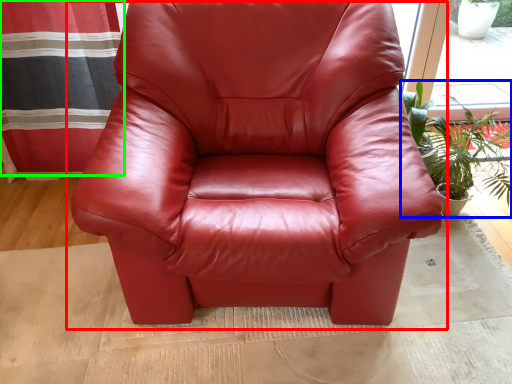
Question: Which object is positioned farthest from chair (highlighted by a red box)? Select from houseplant (highlighted by a blue box) and curtain (highlighted by a green box).

Choices:
 (A) houseplant
 (B) curtain

Answer: (B)